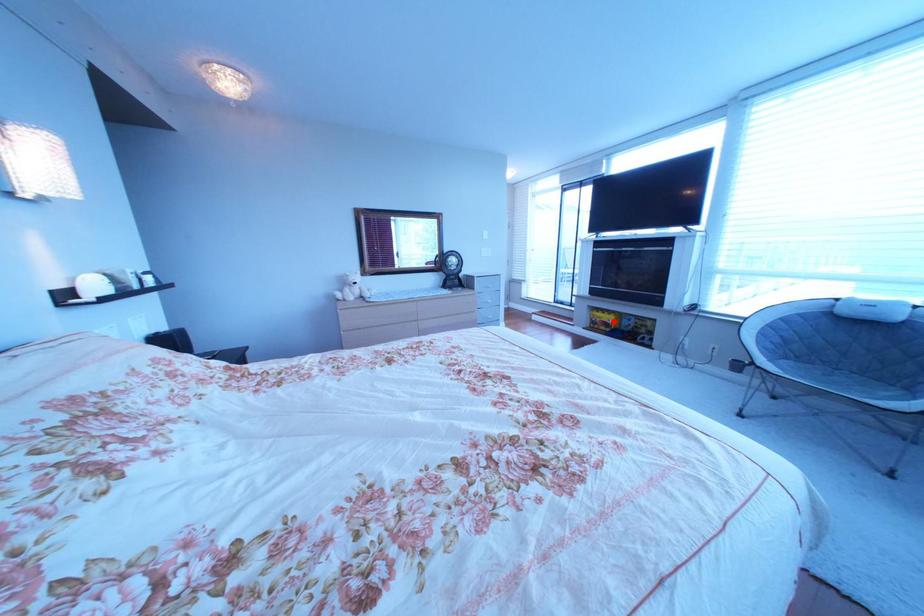
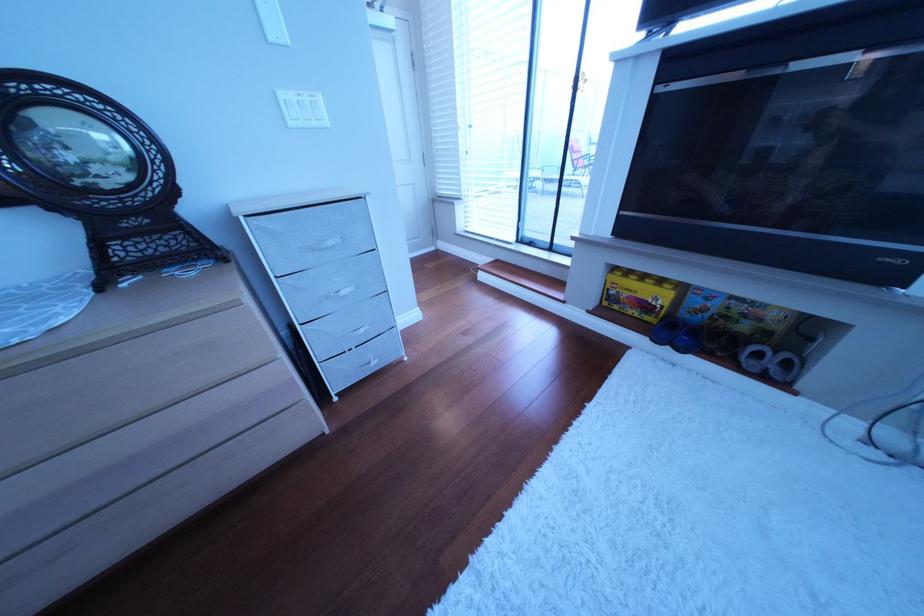
Question: I am providing you with two images of the same scene from different viewpoints. A red point is shown in image1. For the corresponding object point in image2, is it positioned nearer or farther from the camera?

Choices:
 (A) Nearer
 (B) Farther

Answer: (A)